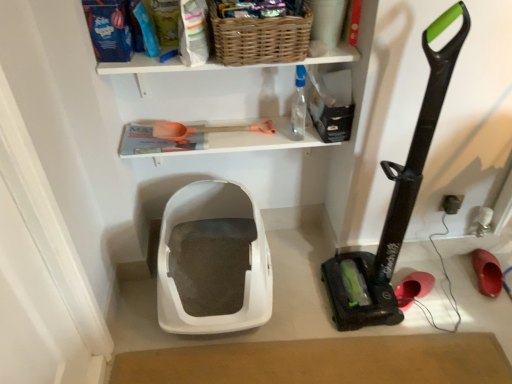
Where is `free location in front of black plastic vacuum cleaner at right`? free location in front of black plastic vacuum cleaner at right is located at coordinates point(374,348).